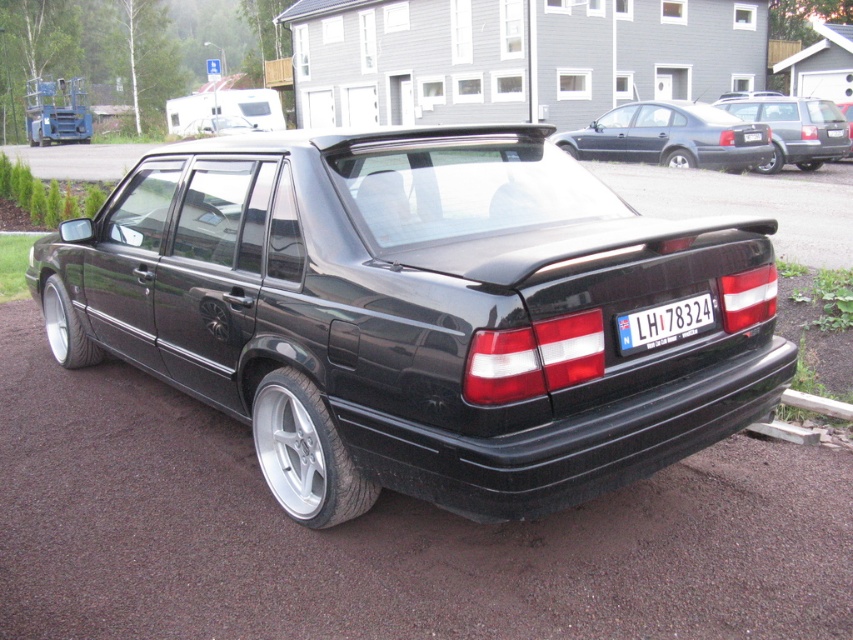
Which is more to the right, black asphalt at center or matte black car at upper right?

matte black car at upper right

Is point (45, 371) farther from camera compared to point (761, 164)?

No, it is not.

Which is behind, point (367, 573) or point (810, 109)?

The point (810, 109) is more distant.

Locate an element on the screen. This screenshot has width=853, height=640. black asphalt at center is located at coordinates (380, 534).

Is black asphalt at center wider than white plastic license plate at center?

Correct, the width of black asphalt at center exceeds that of white plastic license plate at center.

Who is more distant from viewer, (679, 573) or (744, 138)?

The point (744, 138) is behind.

Which is in front, point (778, 518) or point (759, 138)?

Positioned in front is point (778, 518).

I want to click on black asphalt at center, so click(x=380, y=534).

Between point (822, 236) and point (660, 140), which one is positioned behind?

The point (660, 140) is more distant.

Does point (703, 211) come behind point (734, 132)?

That is False.

You are a GUI agent. You are given a task and a screenshot of the screen. Output one action in this format:
    pyautogui.click(x=<x>, y=<y>)
    Task: Click on the black rubber car at center
    The image size is (853, 640).
    Given the screenshot: What is the action you would take?
    pyautogui.click(x=750, y=202)